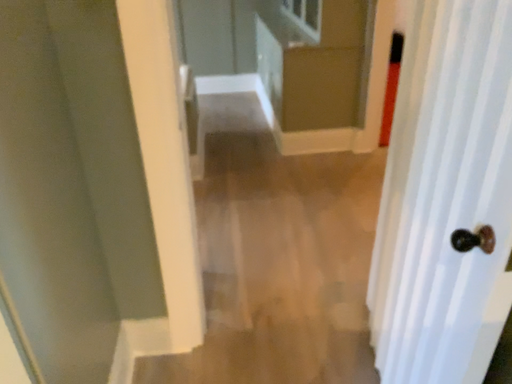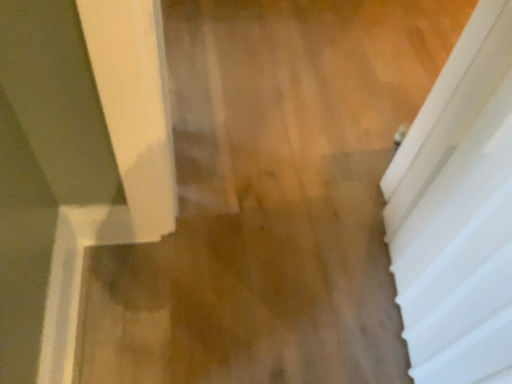
Question: How did the camera likely rotate when shooting the video?

Choices:
 (A) rotated upward
 (B) rotated downward

Answer: (B)